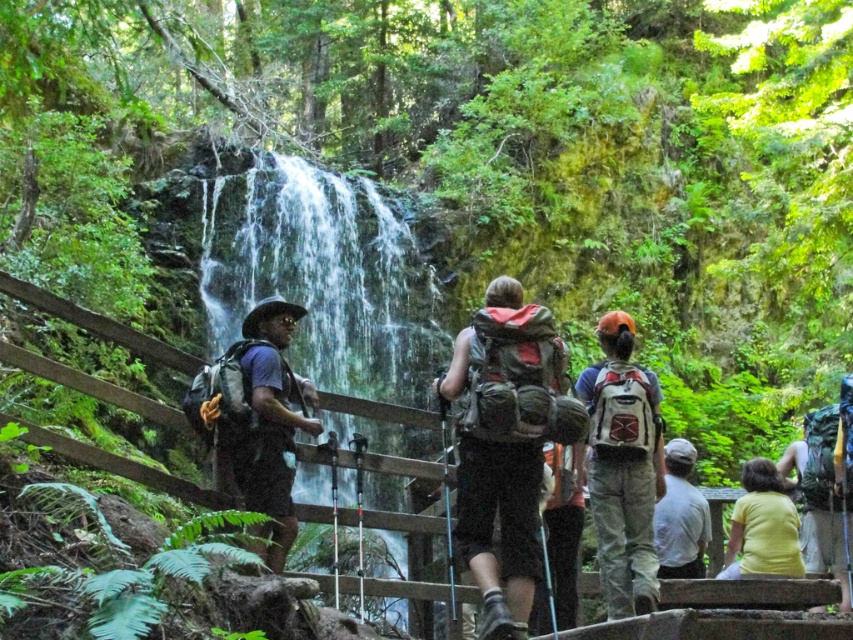
Question: Which of the following is the farthest from the observer?

Choices:
 (A) gray fabric shirt at lower right
 (B) yellow matte shirt at lower right
 (C) clear water at center

Answer: (A)

Question: Is yellow matte shirt at lower right positioned behind gray fabric shirt at lower right?

Choices:
 (A) yes
 (B) no

Answer: (B)

Question: Where is clear water at center located in relation to matte black backpack at left in the image?

Choices:
 (A) left
 (B) right

Answer: (A)

Question: Considering the real-world distances, which object is closest to the matte gray backpack at center?

Choices:
 (A) gray fabric shirt at lower right
 (B) matte black backpack at left

Answer: (A)

Question: Does clear water at center have a greater width compared to matte green backpack at center?

Choices:
 (A) no
 (B) yes

Answer: (B)

Question: Which object appears farthest from the camera in this image?

Choices:
 (A) matte green backpack at center
 (B) clear water at center
 (C) matte gray backpack at center

Answer: (B)